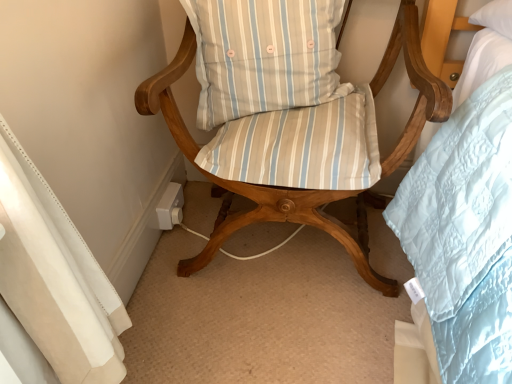
I want to click on vacant area that lies in front of wooden chair with striped cushions at center, so click(278, 344).